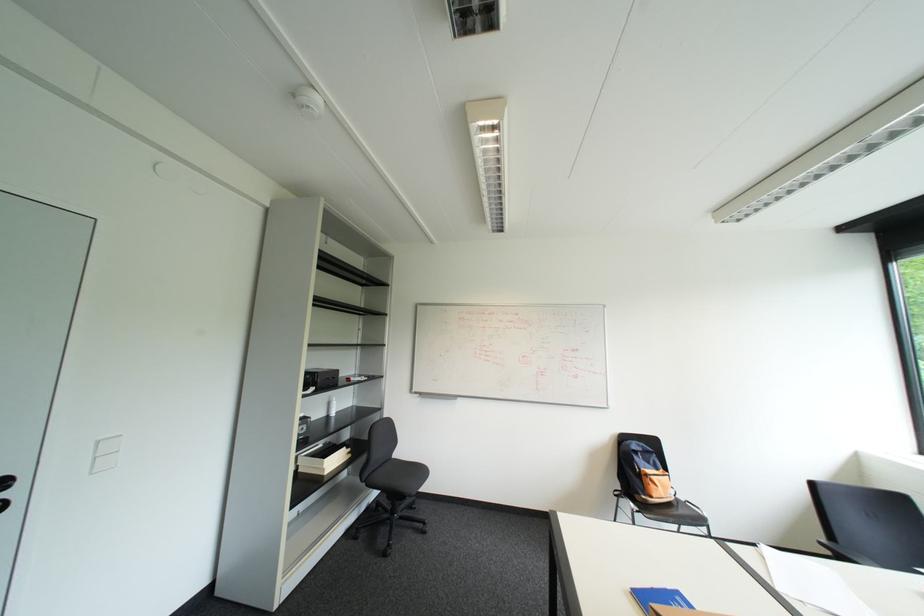
Where would you turn the black door handle? Please return your answer as a coordinate pair (x, y).

(7, 505)